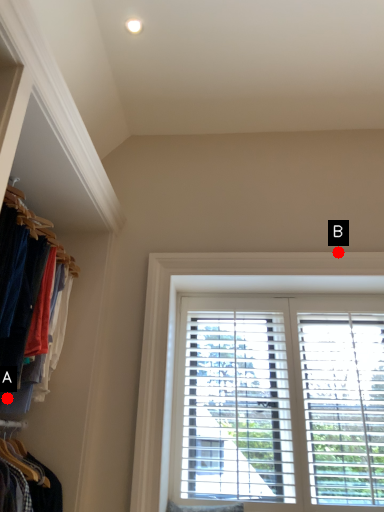
Question: Two points are circled on the image, labeled by A and B beside each circle. Which point appears closest to the camera in this image?

Choices:
 (A) A is closer
 (B) B is closer

Answer: (A)